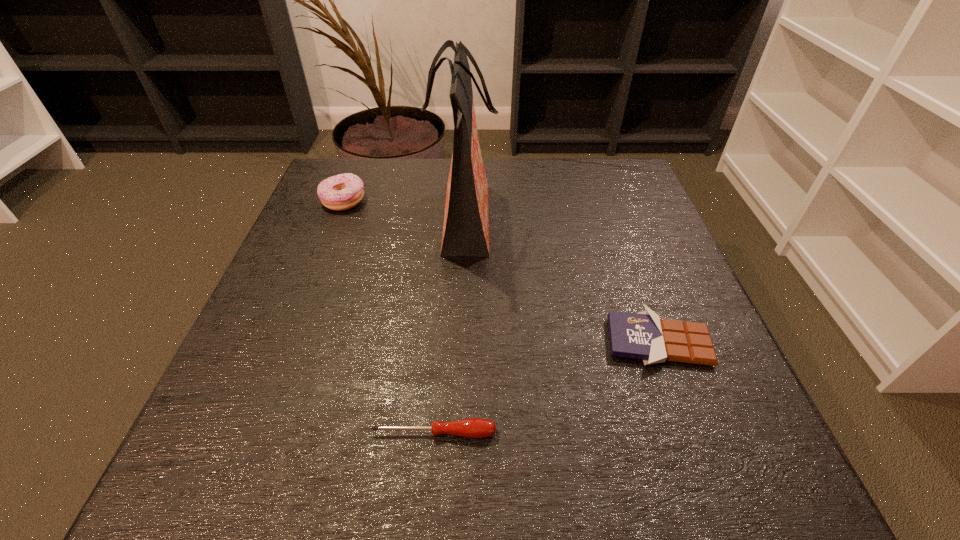
Locate an element on the screen. free point at the far right corner is located at coordinates (617, 192).

Locate an element on the screen. This screenshot has height=540, width=960. vacant space at the near right corner of the desktop is located at coordinates (763, 488).

You are a GUI agent. You are given a task and a screenshot of the screen. Output one action in this format:
    pyautogui.click(x=<x>, y=<y>)
    Task: Click on the empty space that is in between the shopping bag and the rightmost object
    
    Given the screenshot: What is the action you would take?
    pyautogui.click(x=561, y=282)

This screenshot has width=960, height=540. Identify the location of free space between the tallest object and the doughnut. (403, 212).

You are a GUI agent. You are given a task and a screenshot of the screen. Output one action in this format:
    pyautogui.click(x=<x>, y=<y>)
    Task: Click on the free spot between the shopping bag and the doughnut
    The width and height of the screenshot is (960, 540).
    Given the screenshot: What is the action you would take?
    pyautogui.click(x=403, y=212)

The image size is (960, 540). I want to click on free spot between the doughnut and the nearest object, so 389,317.

Locate an element on the screen. This screenshot has height=540, width=960. empty space that is in between the chocolate bar and the shopping bag is located at coordinates (x=561, y=282).

Where is `vacant region between the nearest object and the tallest object`? vacant region between the nearest object and the tallest object is located at coordinates (448, 328).

You are a GUI agent. You are given a task and a screenshot of the screen. Output one action in this format:
    pyautogui.click(x=<x>, y=<y>)
    Task: Click on the free space between the rightmost object and the doughnut
    Image resolution: width=960 pixels, height=540 pixels.
    Given the screenshot: What is the action you would take?
    pyautogui.click(x=501, y=271)

The height and width of the screenshot is (540, 960). Identify the location of free area in between the chocolate bar and the screwdriver. (546, 387).